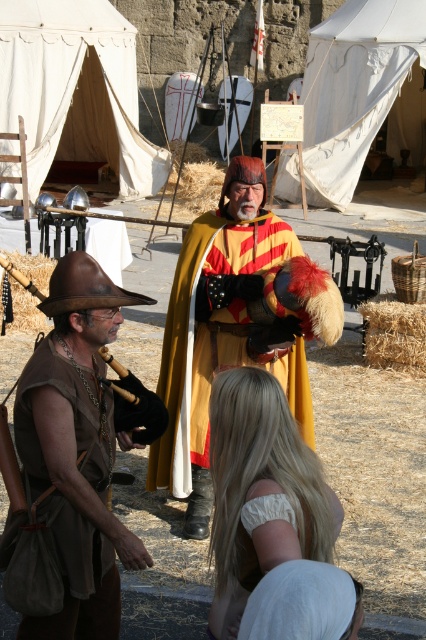
You are a medieval merchant planning to set up a stall near the white canvas tent at upper left and the brown straw at left. Which object is larger in size?

The brown straw at left is larger than the white canvas tent at upper left.

You are setting up a camp in the medieval reenactment area. You need to place a flagpole that requires at least 3 meters of vertical space. Which object between the white canvas tent at upper center and the light brown straw bale at lower right can you safely place the flagpole next to without obstructing the height requirement?

The white canvas tent at upper center has a lesser height compared to the light brown straw bale at lower right. Since the flagpole requires at least 3 meters of vertical space, you should place it next to the white canvas tent at upper center because it is shorter and less likely to obstruct the required height.